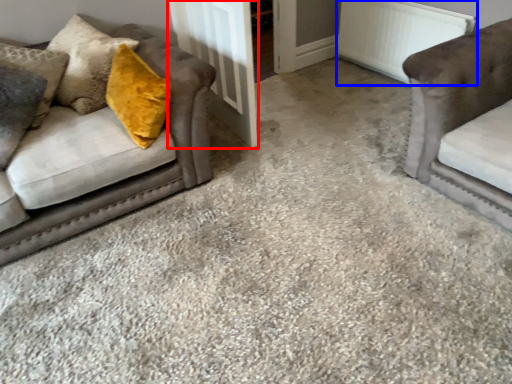
Question: Among these objects, which one is farthest to the camera, door (highlighted by a red box) or radiator (highlighted by a blue box)?

Choices:
 (A) door
 (B) radiator

Answer: (B)